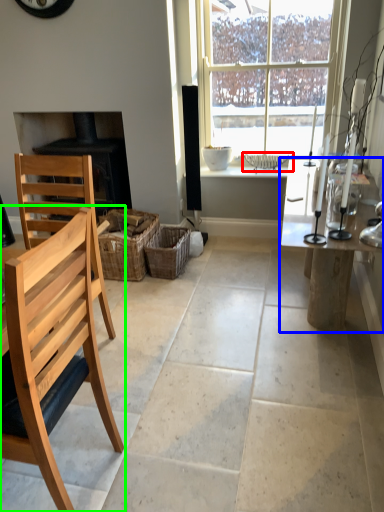
Question: Considering the real-world distances, which object is farthest from basket (highlighted by a red box)? table (highlighted by a blue box) or chair (highlighted by a green box)?

Choices:
 (A) table
 (B) chair

Answer: (B)